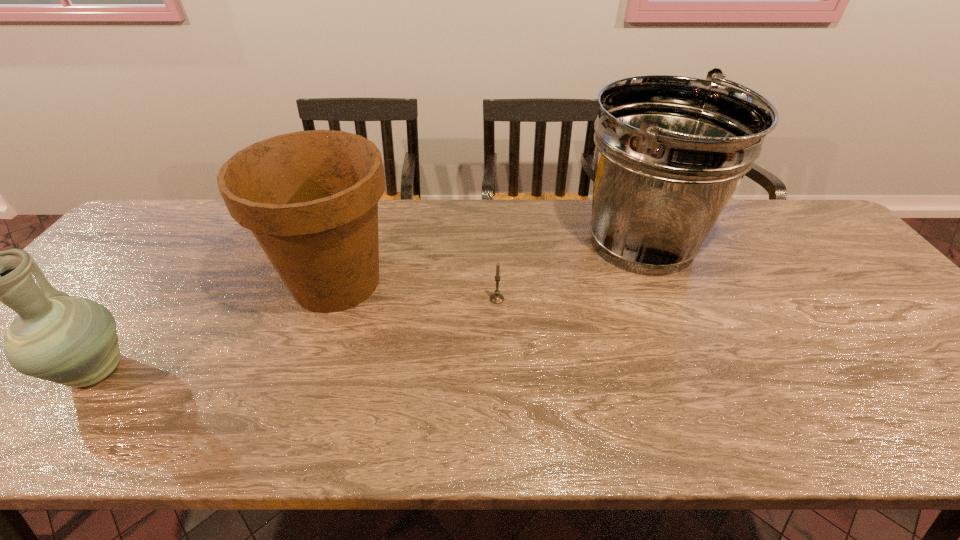
At what (x,y) coordinates should I click in order to perform the action: click on vacant space at the left edge. Please return your answer as a coordinate pair (x, y). Looking at the image, I should click on (91, 287).

This screenshot has width=960, height=540. What are the coordinates of `free region at the far left corner of the desktop` in the screenshot? It's located at (129, 239).

Identify the location of free space between the flowerpot and the nearest object. (217, 327).

Identify the location of empty location between the flowerpot and the leftmost object. The image size is (960, 540). (217, 327).

Find the location of a particular element. The height and width of the screenshot is (540, 960). vacant region between the shortest object and the nearest object is located at coordinates (297, 335).

Find the location of a particular element. The height and width of the screenshot is (540, 960). free spot between the bucket and the second object from left to right is located at coordinates (490, 262).

This screenshot has height=540, width=960. I want to click on unoccupied position between the third object from right to left and the shortest object, so click(x=417, y=291).

The image size is (960, 540). I want to click on vacant space that's between the bucket and the candle, so click(569, 271).

The image size is (960, 540). Identify the location of free spot between the shortest object and the second object from left to right. (417, 291).

Where is `free space that is in between the third object from right to left and the tallest object`? This screenshot has height=540, width=960. free space that is in between the third object from right to left and the tallest object is located at coordinates (490, 262).